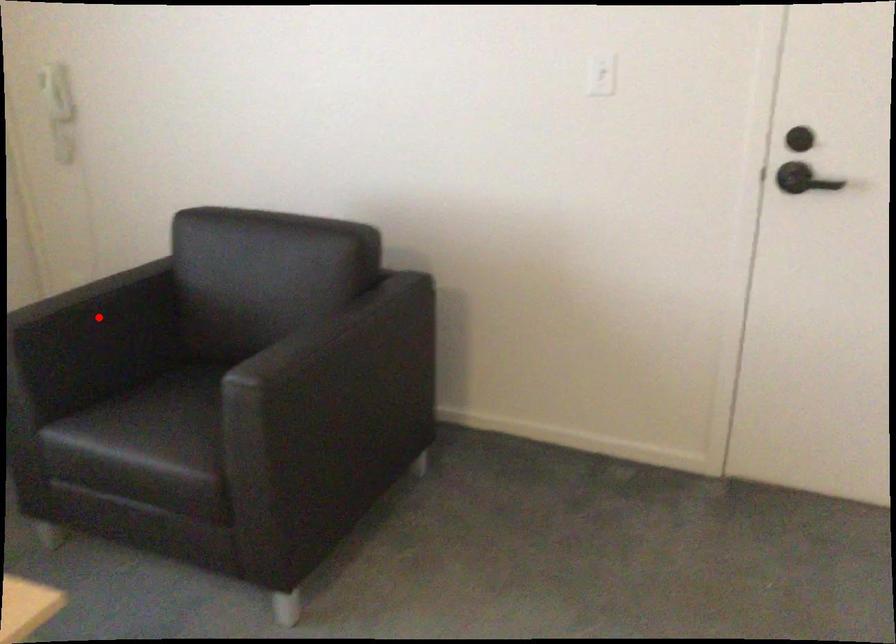
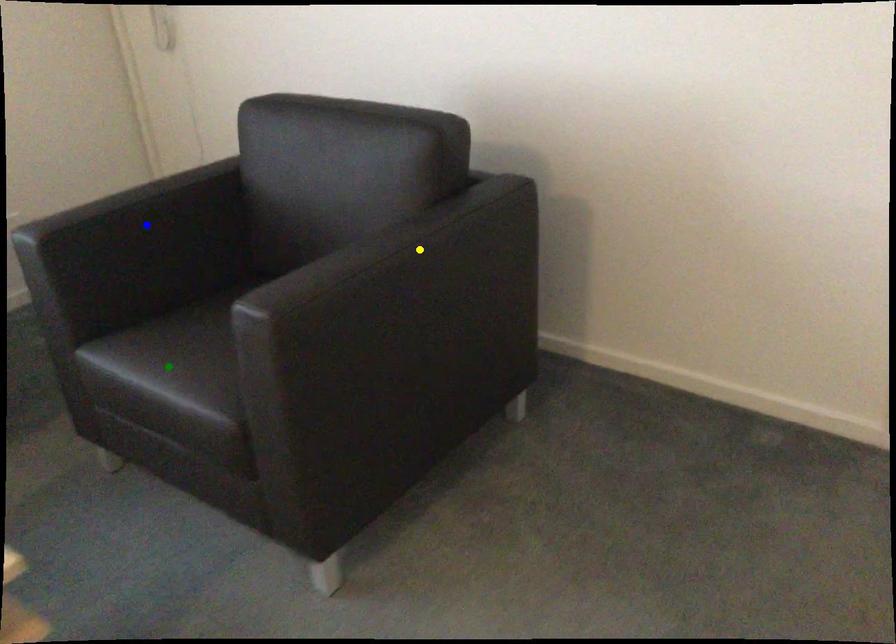
Question: I am providing you with two images of the same scene from different viewpoints. A red point is marked on the first image. You are given multiple points on the second image. Can you choose the point in image 2 that corresponds to the point in image 1?

Choices:
 (A) yellow point
 (B) green point
 (C) blue point

Answer: (C)